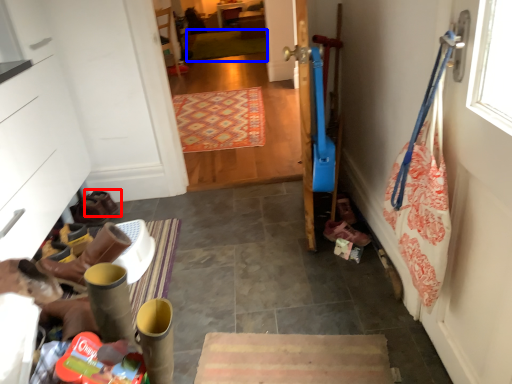
Question: Among these objects, which one is nearest to the camera, footwear (highlighted by a red box) or mat (highlighted by a blue box)?

Choices:
 (A) footwear
 (B) mat

Answer: (A)